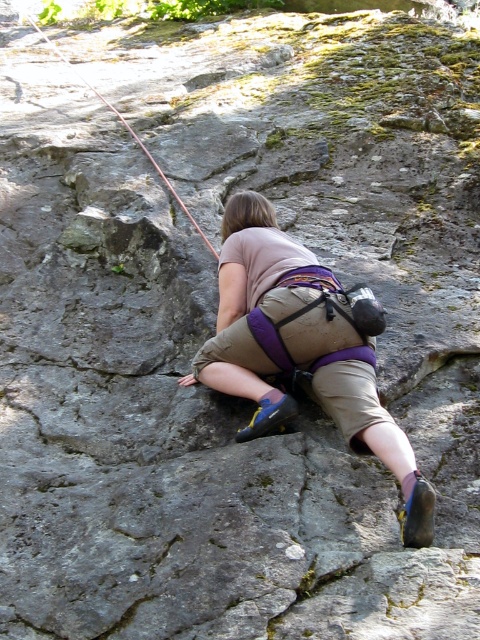
Who is positioned more to the right, khaki cotton shorts at center or red nylon rope at upper center?

khaki cotton shorts at center

Is khaki cotton shorts at center wider than red nylon rope at upper center?

No, khaki cotton shorts at center is not wider than red nylon rope at upper center.

Where is `khaki cotton shorts at center`? This screenshot has height=640, width=480. khaki cotton shorts at center is located at coordinates (302, 346).